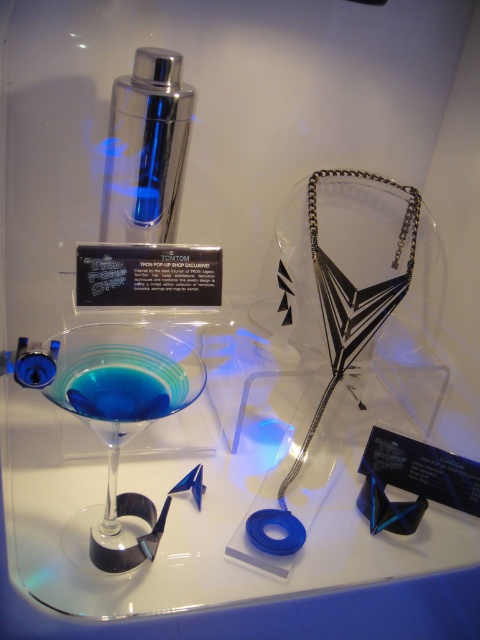
You are a customer at the TRON POP UP SHOP EXCLUSIVE by TOMTOM. You see a transparent glass martini glass at center and a shiny metallic cocktail shaker at upper left. Which object is taller?

The transparent glass martini glass at center is much taller than the shiny metallic cocktail shaker at upper left.

You are a customer at the TRON POP UP SHOP EXCLUSIVE by TOMTOM. You see two points in the display case. The first point is at coordinates point [84,376] and the second is at point [72,403]. Which point is closer to you?

Point [84,376] is further to the camera than point [72,403], so the second point is closer to you.

You are a customer at the TRON POP UP SHOP EXCLUSIVE by TOMTOM. You see the shiny metallic cocktail shaker at upper left and the blue translucent liquid at lower left. Which object is located above the other?

The shiny metallic cocktail shaker at upper left is positioned over blue translucent liquid at lower left.